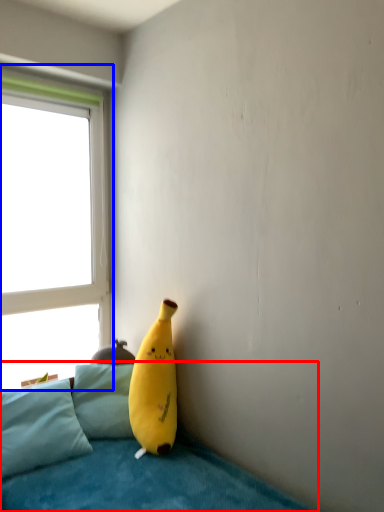
Question: Which object appears closest to the camera in this image, studio couch (highlighted by a red box) or window (highlighted by a blue box)?

Choices:
 (A) studio couch
 (B) window

Answer: (A)